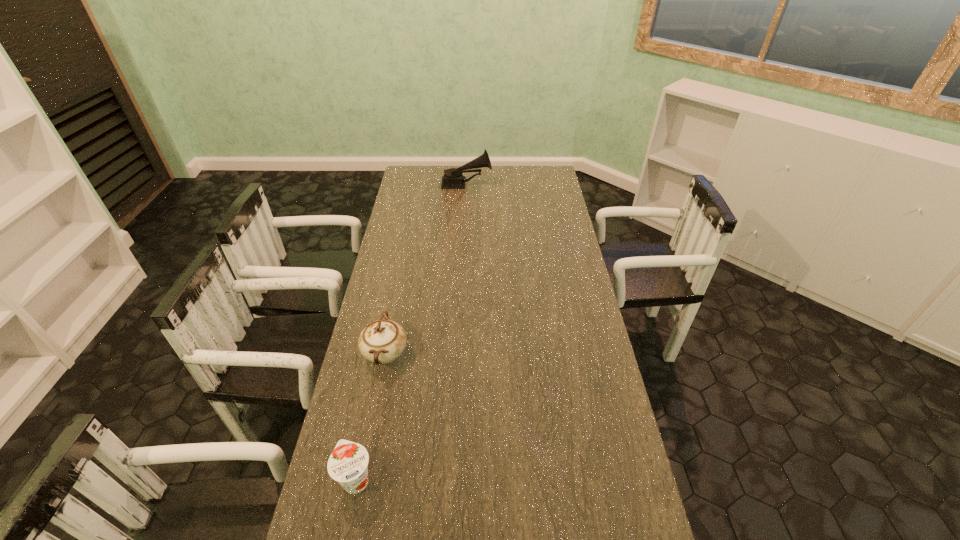
Identify the location of the tallest object. Image resolution: width=960 pixels, height=540 pixels. (453, 178).

Identify the location of phonograph_record. (453, 178).

Locate an element on the screen. The height and width of the screenshot is (540, 960). the second shortest object is located at coordinates (382, 341).

Find the location of a particular element. Image resolution: width=960 pixels, height=540 pixels. chinaware is located at coordinates (382, 341).

Identify the location of the shortest object. (348, 462).

What are the coordinates of `the nearest object` in the screenshot? It's located at pyautogui.click(x=348, y=462).

You are a GUI agent. You are given a task and a screenshot of the screen. Output one action in this format:
    pyautogui.click(x=<x>, y=<y>)
    Task: Click on the vacant area situated from the horn of the farthest object
    This screenshot has height=540, width=960.
    Given the screenshot: What is the action you would take?
    pyautogui.click(x=509, y=184)

The height and width of the screenshot is (540, 960). Find the location of `blank area located 0.120m on the front of the second tallest object`. blank area located 0.120m on the front of the second tallest object is located at coordinates (373, 415).

At what (x,y) coordinates should I click in order to perform the action: click on vacant area situated 0.110m on the right of the yogurt. Please return your answer as a coordinate pair (x, y). Image resolution: width=960 pixels, height=540 pixels. Looking at the image, I should click on (418, 480).

Where is `object that is positioned at the far edge`? The image size is (960, 540). object that is positioned at the far edge is located at coordinates (453, 178).